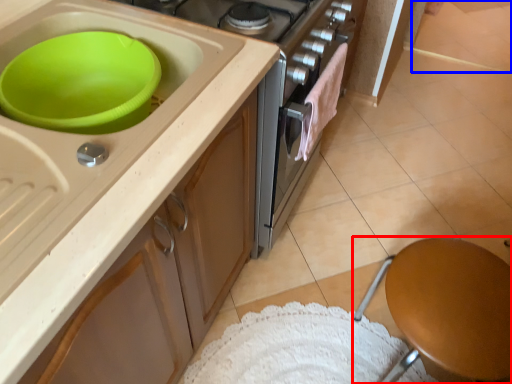
Question: Which object appears closest to the camera in this image, furniture (highlighted by a red box) or tile (highlighted by a blue box)?

Choices:
 (A) furniture
 (B) tile

Answer: (A)